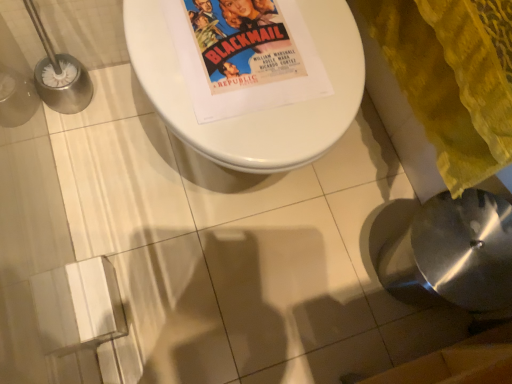
Locate an element on the screen. free point behind satin silver sink at lower right is located at coordinates (371, 199).